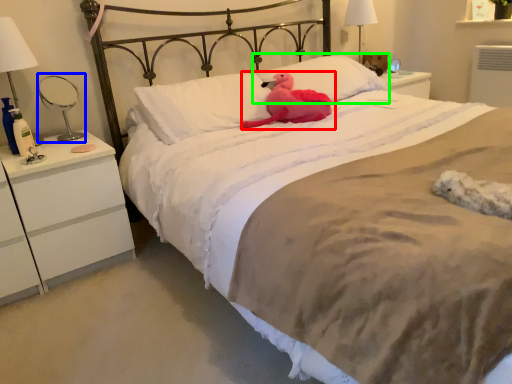
Question: Estimate the real-world distances between objects in this image. Which object is closer to animal (highlighted by a red box), table lamp (highlighted by a blue box) or pillow (highlighted by a green box)?

Choices:
 (A) table lamp
 (B) pillow

Answer: (B)